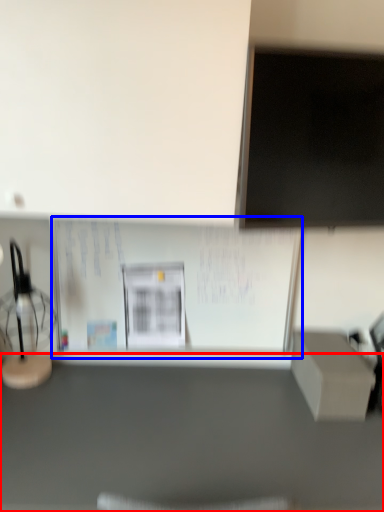
Question: Which object appears closest to the camera in this image, furniture (highlighted by a red box) or bulletin board (highlighted by a blue box)?

Choices:
 (A) furniture
 (B) bulletin board

Answer: (A)